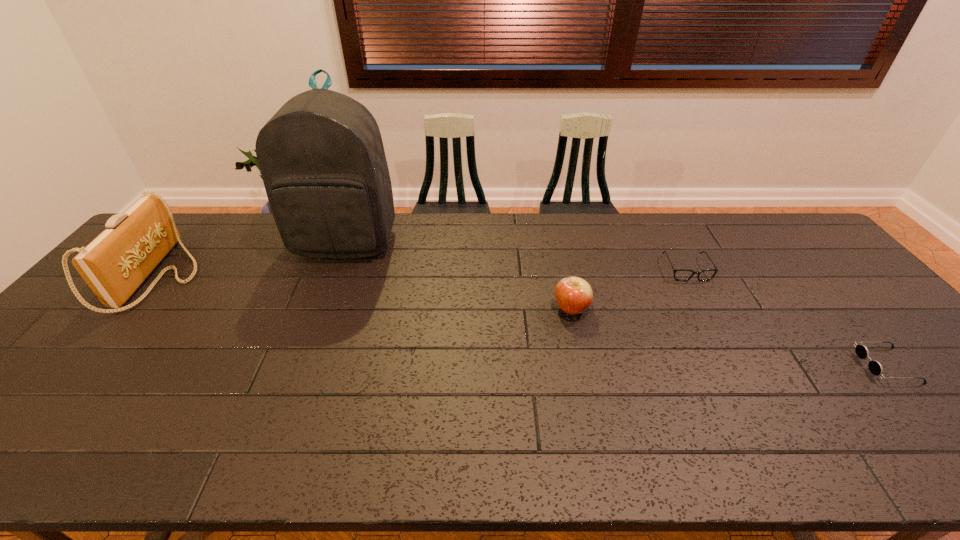
You are a GUI agent. You are given a task and a screenshot of the screen. Output one action in this format:
    pyautogui.click(x=<x>, y=<y>)
    Task: Click on the vacant region that satisfies the following two spatial constraints: 1. on the front-facing side of the spectacles; 2. on the decorative side of the handbag
    The image size is (960, 540).
    Given the screenshot: What is the action you would take?
    pyautogui.click(x=690, y=277)

Find the location of `free location that satisfies the following two spatial constraints: 1. on the front-facing side of the tallest object; 2. on the left side of the third object from left to right`. free location that satisfies the following two spatial constraints: 1. on the front-facing side of the tallest object; 2. on the left side of the third object from left to right is located at coordinates (321, 309).